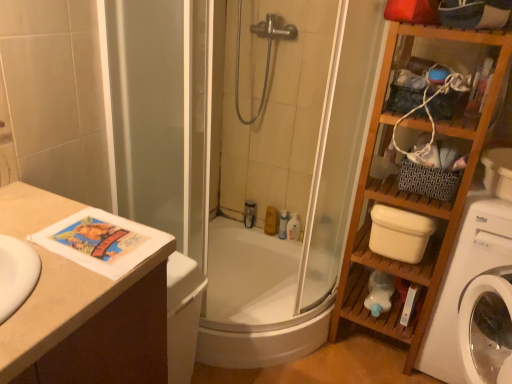
This screenshot has width=512, height=384. I want to click on white plastic washing machine at right, so click(465, 281).

Describe the element at coordinates (293, 227) in the screenshot. I see `white plastic bottle at center, placed as the fourth toiletry when sorted from left to right` at that location.

The width and height of the screenshot is (512, 384). What do you see at coordinates (283, 224) in the screenshot? I see `translucent plastic bottle at center, which is counted as the 3th toiletry, starting from the left` at bounding box center [283, 224].

Where is `silver metallic showerhead at upper center`? Image resolution: width=512 pixels, height=384 pixels. silver metallic showerhead at upper center is located at coordinates (267, 52).

Does point (452, 209) lie in front of point (282, 232)?

Yes, it is.

In terms of width, does wooden shelf at right look wider or thinner when compared to translucent plastic bottle at center, which is counted as the 3th toiletry, starting from the left?

wooden shelf at right is wider than translucent plastic bottle at center, which is counted as the 3th toiletry, starting from the left.

From the image's perspective, which is above, wooden shelf at right or translucent plastic bottle at center, which is counted as the 3th toiletry, starting from the left?

wooden shelf at right is shown above in the image.

In the scene shown: How different are the orientations of wooden shelf at right and translucent plastic bottle at center, which is counted as the 3th toiletry, starting from the left, in degrees?

They differ by 1.36 degrees in their facing directions.

From a real-world perspective, is translucent plastic bottle at upper center, the 1th toiletry viewed from the left, located higher than white plastic toilet bowl at right?

No.

Considering the sizes of objects translucent plastic bottle at upper center, the 1th toiletry viewed from the left, and white plastic toilet bowl at right in the image provided, who is bigger, translucent plastic bottle at upper center, the 1th toiletry viewed from the left, or white plastic toilet bowl at right?

white plastic toilet bowl at right is bigger.

Could white plastic toilet bowl at right be considered to be inside translucent plastic bottle at upper center, the 4th toiletry viewed from the right?

No, translucent plastic bottle at upper center, the 4th toiletry viewed from the right, does not contain white plastic toilet bowl at right.

Is wooden shelf at right inside white plastic bottle at center, placed as the fourth toiletry when sorted from left to right?

No, wooden shelf at right is located outside of white plastic bottle at center, placed as the fourth toiletry when sorted from left to right.

From the picture: From a real-world perspective, which object rests below the other?

white plastic bottle at center, placed as the fourth toiletry when sorted from left to right, from a real-world perspective.

At what (x,y) coordinates should I click in order to perform the action: click on cabinet above the white plastic bottle at center, placed as the 1th toiletry when sorted from right to left (from the image's perspective). Please return your answer as a coordinate pair (x, y). This screenshot has width=512, height=384. Looking at the image, I should click on (411, 195).

Looking at this image, does white plastic bottle at center, placed as the fourth toiletry when sorted from left to right, appear on the left side of wooden shelf at right?

Indeed, white plastic bottle at center, placed as the fourth toiletry when sorted from left to right, is positioned on the left side of wooden shelf at right.

Does translucent plastic bottle at center, which is counted as the 2th toiletry, starting from the right, lie behind white plastic toilet bowl at right?

Yes, it is.

From a real-world perspective, is translucent plastic bottle at center, which is counted as the 2th toiletry, starting from the right, physically located above or below white plastic toilet bowl at right?

Clearly, from a real-world perspective, translucent plastic bottle at center, which is counted as the 2th toiletry, starting from the right, is below white plastic toilet bowl at right.

What's the angular difference between translucent plastic bottle at center, which is counted as the 2th toiletry, starting from the right, and white plastic toilet bowl at right's facing directions?

The facing directions of translucent plastic bottle at center, which is counted as the 2th toiletry, starting from the right, and white plastic toilet bowl at right are 1.36 degrees apart.

Which is more to the right, silver metallic showerhead at upper center or translucent plastic bottle at center, which is counted as the 2th toiletry, starting from the right?

From the viewer's perspective, translucent plastic bottle at center, which is counted as the 2th toiletry, starting from the right, appears more on the right side.

I want to click on toiletry that is the 3rd object located below the silver metallic showerhead at upper center (from the image's perspective), so click(283, 224).

Is silver metallic showerhead at upper center next to translucent plastic bottle at center, which is counted as the 3th toiletry, starting from the left, and touching it?

No.

Who is shorter, silver metallic showerhead at upper center or translucent plastic bottle at center, which is counted as the 2th toiletry, starting from the right?

translucent plastic bottle at center, which is counted as the 2th toiletry, starting from the right.

Can translucent plastic bottle at center, which is counted as the 3th toiletry, starting from the left, be found inside white glossy bathtub at center?

No, translucent plastic bottle at center, which is counted as the 3th toiletry, starting from the left, is not a part of white glossy bathtub at center.

This screenshot has height=384, width=512. I want to click on bath below the translucent plastic bottle at center, which is counted as the 3th toiletry, starting from the left (from a real-world perspective), so click(x=255, y=301).

Does point (330, 316) come behind point (286, 227)?

That is False.

Which is in front, white glossy bathtub at center or translucent plastic bottle at center, which is counted as the 2th toiletry, starting from the right?

white glossy bathtub at center is closer to the camera.

How distant is wooden shelf at right from translucent plastic bottle at upper center, the 4th toiletry viewed from the right?

wooden shelf at right and translucent plastic bottle at upper center, the 4th toiletry viewed from the right, are 3.42 feet apart from each other.

In the scene shown: Is wooden shelf at right facing towards translucent plastic bottle at upper center, the 4th toiletry viewed from the right?

No.

Consider the image. From their relative heights in the image, would you say wooden shelf at right is taller or shorter than translucent plastic bottle at upper center, the 4th toiletry viewed from the right?

wooden shelf at right is taller than translucent plastic bottle at upper center, the 4th toiletry viewed from the right.

Identify the location of cabinet located above the translucent plastic bottle at center, which is counted as the 2th toiletry, starting from the right (from the image's perspective). (411, 195).

Where is `the 4th toiletry behind the white plastic toilet bowl at right`? the 4th toiletry behind the white plastic toilet bowl at right is located at coordinates (249, 213).

From the image, which object appears to be nearer to translucent plastic bottle at center, which is counted as the 2th toiletry, starting from the right, silver metallic showerhead at upper center or white plastic bottle at center, placed as the 1th toiletry when sorted from right to left?

white plastic bottle at center, placed as the 1th toiletry when sorted from right to left, is closer to translucent plastic bottle at center, which is counted as the 2th toiletry, starting from the right.

Which object lies further to the anchor point matte yellow soap at center, which is the second toiletry in left-to-right order, white plastic washing machine at right or silver metallic showerhead at upper center?

white plastic washing machine at right.

Considering their positions, is white plastic bottle at center, placed as the fourth toiletry when sorted from left to right, positioned closer to white plastic washing machine at right than white glossy bathtub at center?

white glossy bathtub at center is positioned closer to the anchor white plastic washing machine at right.

Which object lies nearer to the anchor point white plastic bottle at center, placed as the 1th toiletry when sorted from right to left, wooden shelf at right or white glossy bathtub at center?

Among the two, white glossy bathtub at center is located nearer to white plastic bottle at center, placed as the 1th toiletry when sorted from right to left.

Which object lies further to the anchor point silver metallic showerhead at upper center, matte yellow soap at center, placed as the third toiletry when sorted from right to left, or translucent plastic bottle at center, which is counted as the 3th toiletry, starting from the left?

The object further to silver metallic showerhead at upper center is translucent plastic bottle at center, which is counted as the 3th toiletry, starting from the left.

When comparing their distances from translucent plastic bottle at center, which is counted as the 3th toiletry, starting from the left, does white glossy bathtub at center or translucent plastic bottle at upper center, the 4th toiletry viewed from the right, seem closer?

Based on the image, translucent plastic bottle at upper center, the 4th toiletry viewed from the right, appears to be nearer to translucent plastic bottle at center, which is counted as the 3th toiletry, starting from the left.

Considering their positions, is translucent plastic bottle at center, which is counted as the 3th toiletry, starting from the left, positioned closer to matte yellow soap at center, placed as the third toiletry when sorted from right to left, than white glossy bathtub at center?

translucent plastic bottle at center, which is counted as the 3th toiletry, starting from the left, lies closer to matte yellow soap at center, placed as the third toiletry when sorted from right to left, than the other object.

Which object lies further to the anchor point wooden shelf at right, white plastic bottle at center, placed as the 1th toiletry when sorted from right to left, or matte yellow soap at center, placed as the third toiletry when sorted from right to left?

matte yellow soap at center, placed as the third toiletry when sorted from right to left, lies further to wooden shelf at right than the other object.

Locate an element on the screen. This screenshot has height=384, width=512. bath between wooden shelf at right and matte yellow soap at center, placed as the third toiletry when sorted from right to left, in the front-back direction is located at coordinates click(255, 301).

This screenshot has width=512, height=384. Find the location of `bath between white plastic washing machine at right and translucent plastic bottle at center, which is counted as the 3th toiletry, starting from the left, along the z-axis`. bath between white plastic washing machine at right and translucent plastic bottle at center, which is counted as the 3th toiletry, starting from the left, along the z-axis is located at coordinates (255, 301).

Where is `bath located between white plastic toilet bowl at right and translucent plastic bottle at center, which is counted as the 2th toiletry, starting from the right, in the depth direction`? This screenshot has height=384, width=512. bath located between white plastic toilet bowl at right and translucent plastic bottle at center, which is counted as the 2th toiletry, starting from the right, in the depth direction is located at coordinates (255, 301).

Find the location of `toilet bowl between white glossy bathtub at center and wooden shelf at right`. toilet bowl between white glossy bathtub at center and wooden shelf at right is located at coordinates tap(399, 233).